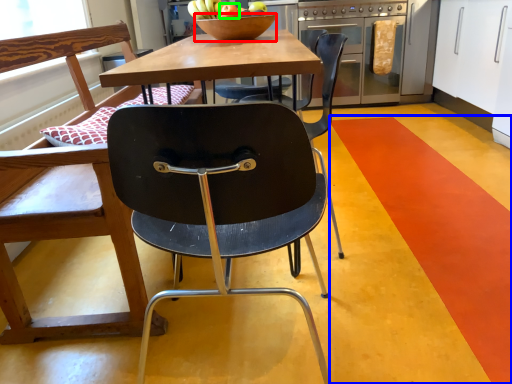
Question: Estimate the real-world distances between objects in this image. Which object is closer to bowl (highlighted by a red box), stripe (highlighted by a blue box) or apple (highlighted by a green box)?

Choices:
 (A) stripe
 (B) apple

Answer: (B)